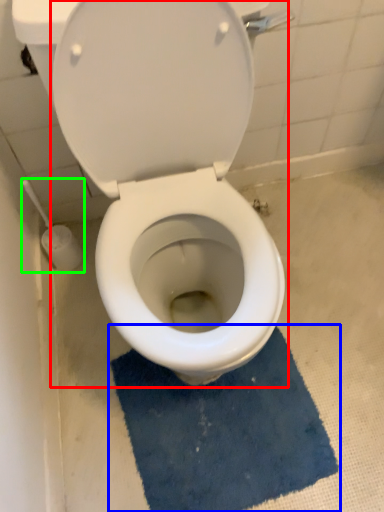
Question: Which object is the closest to the toilet (highlighted by a red box)? Choose among these: bath mat (highlighted by a blue box) or brush (highlighted by a green box).

Choices:
 (A) bath mat
 (B) brush

Answer: (A)